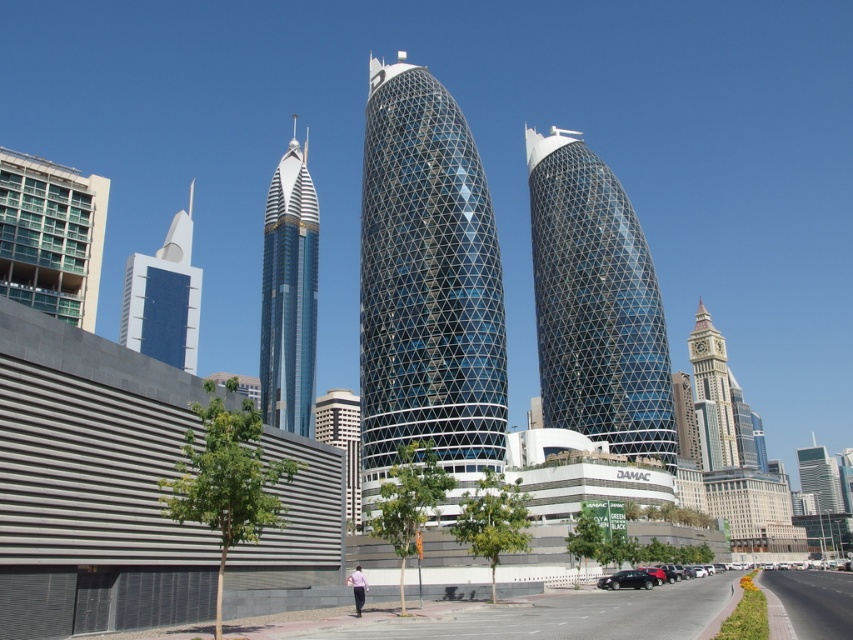
Question: Among these points, which one is farthest from the camera?

Choices:
 (A) (x=76, y=189)
 (B) (x=633, y=586)
 (C) (x=137, y=348)
 (D) (x=706, y=365)

Answer: (D)

Question: Can you confirm if transparent glass tower at center is thinner than gold textured clock tower at right?

Choices:
 (A) no
 (B) yes

Answer: (A)

Question: Does blue glass skyscraper at left appear on the left side of glassy metallic skyscraper at right?

Choices:
 (A) yes
 (B) no

Answer: (A)

Question: Is blue glass skyscraper at left thinner than gold textured clock tower at right?

Choices:
 (A) yes
 (B) no

Answer: (B)

Question: Which of these objects is positioned closest to the blue glass skyscraper at left?

Choices:
 (A) transparent glass tower at center
 (B) green glass building at upper left
 (C) glossy glass skyscraper at center
 (D) glassy metallic skyscraper at right

Answer: (C)

Question: Which point is farther from the camera taking this photo?

Choices:
 (A) (434, 273)
 (B) (589, 358)

Answer: (B)